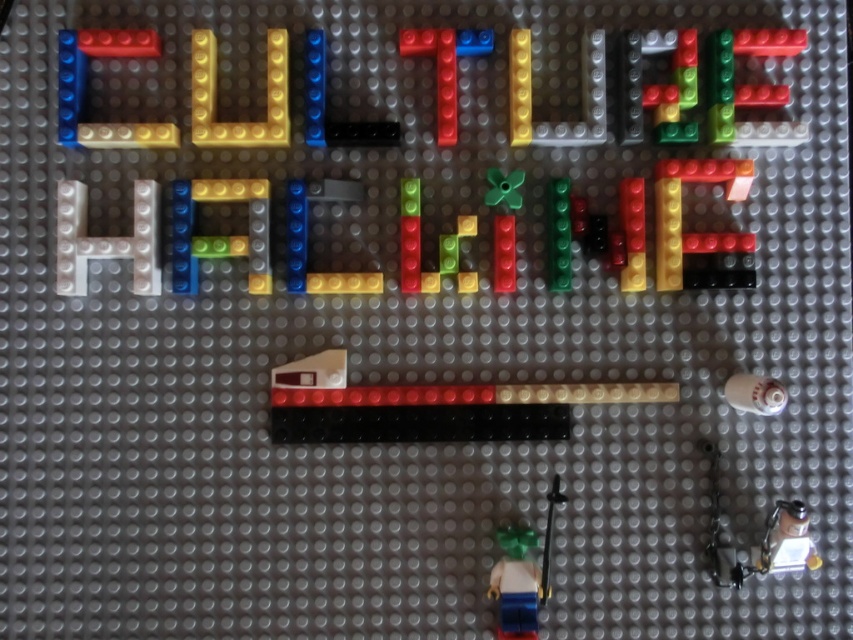
Question: Can you confirm if smooth plastic ruler at center is positioned above matte plastic bricks at upper left?

Choices:
 (A) no
 (B) yes

Answer: (A)

Question: Does translucent yellow plastic at center appear on the right side of white glossy bottle at upper right?

Choices:
 (A) no
 (B) yes

Answer: (A)

Question: Estimate the real-world distances between objects in this image. Which object is farther from the smooth plastic minifigure at lower center?

Choices:
 (A) white glossy bottle at upper right
 (B) white matte letter h at left

Answer: (B)

Question: Which of the following is the closest to the observer?

Choices:
 (A) translucent yellow plastic at center
 (B) translucent blue plastic number seven at upper center
 (C) white matte letter h at left

Answer: (C)

Question: In this image, where is smooth plastic ruler at center located relative to matte plastic bricks at upper left?

Choices:
 (A) above
 (B) below

Answer: (B)

Question: Which object is closer to the camera taking this photo?

Choices:
 (A) yellow matte letter u at upper center
 (B) matte plastic bricks at upper left
 (C) translucent yellow plastic at center
 (D) translucent yellow brick at center

Answer: (B)